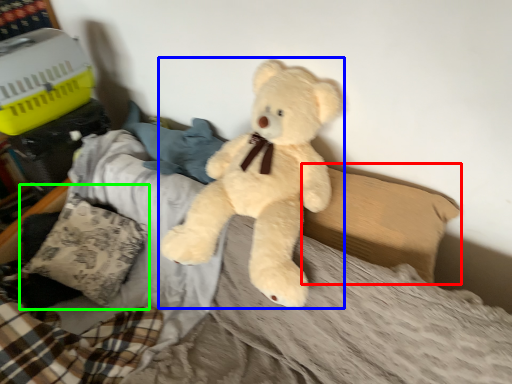
Question: Estimate the real-world distances between objects in this image. Which object is farther from pillow (highlighted by a red box), teddy bear (highlighted by a blue box) or pillow (highlighted by a green box)?

Choices:
 (A) teddy bear
 (B) pillow

Answer: (B)